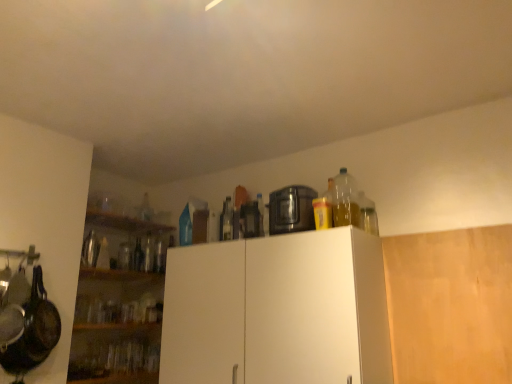
What do you see at coordinates (124, 222) in the screenshot? I see `wooden shelves at upper center` at bounding box center [124, 222].

How much space does black plastic toaster at upper center, the 2th appliance when ordered from left to right, occupy vertically?

black plastic toaster at upper center, the 2th appliance when ordered from left to right, is 7.35 inches tall.

Locate an element on the screen. This screenshot has height=384, width=512. transparent plastic bottle at upper center, the 4th bottle viewed from the right is located at coordinates (145, 209).

What is the approximate height of brushed metal thermos at left, the 1th appliance viewed from the left?

It is 10.02 inches.

Where is `wooden shelves at upper center`? wooden shelves at upper center is located at coordinates (124, 222).

From the image's perspective, is clear glass bottle at center, acting as the third bottle starting from the right, positioned above or below black plastic toaster at upper center, the second appliance in the right-to-left sequence?

Clearly, from the image's perspective, clear glass bottle at center, acting as the third bottle starting from the right, is below black plastic toaster at upper center, the second appliance in the right-to-left sequence.

Who is smaller, clear glass bottle at center, acting as the third bottle starting from the right, or black plastic toaster at upper center, the second appliance in the right-to-left sequence?

black plastic toaster at upper center, the second appliance in the right-to-left sequence, is smaller.

This screenshot has width=512, height=384. Find the location of `the 2nd bottle to the left of the black plastic toaster at upper center, the second appliance in the right-to-left sequence, starting your count from the anchor`. the 2nd bottle to the left of the black plastic toaster at upper center, the second appliance in the right-to-left sequence, starting your count from the anchor is located at coordinates (138, 256).

Considering the sizes of clear glass bottle at center, acting as the third bottle starting from the right, and black plastic toaster at upper center, the 2th appliance when ordered from left to right, in the image, is clear glass bottle at center, acting as the third bottle starting from the right, taller or shorter than black plastic toaster at upper center, the 2th appliance when ordered from left to right,?

Clearly, clear glass bottle at center, acting as the third bottle starting from the right, is taller compared to black plastic toaster at upper center, the 2th appliance when ordered from left to right.

From the image's perspective, would you say black matte frying pan at left is shown under white matte cabinet at upper center, which is the 1th cabinetry from left to right?

Result: Incorrect, from the image's perspective, black matte frying pan at left is higher than white matte cabinet at upper center, which is the 1th cabinetry from left to right.

Considering their positions, is black matte frying pan at left located in front of or behind white matte cabinet at upper center, which is the 1th cabinetry from left to right?

Visually, black matte frying pan at left is located behind white matte cabinet at upper center, which is the 1th cabinetry from left to right.

Can white matte cabinet at upper center, which is the 1th cabinetry from left to right, be found inside black matte frying pan at left?

That's incorrect, white matte cabinet at upper center, which is the 1th cabinetry from left to right, is not inside black matte frying pan at left.

In terms of width, does black matte frying pan at left look wider or thinner when compared to white matte cabinet at upper center, which is the 1th cabinetry from left to right?

Clearly, black matte frying pan at left has less width compared to white matte cabinet at upper center, which is the 1th cabinetry from left to right.

Is point (190, 380) in front of point (257, 216)?

Yes, it is.

Which object is wider, white matte cabinet at upper center, which is counted as the 2th cabinetry, starting from the right, or black plastic toaster at upper center, the 2th appliance when ordered from left to right?

white matte cabinet at upper center, which is counted as the 2th cabinetry, starting from the right.

Which of these two, white matte cabinet at upper center, which is the 1th cabinetry from left to right, or black plastic toaster at upper center, the 2th appliance when ordered from left to right, is bigger?

white matte cabinet at upper center, which is the 1th cabinetry from left to right, is bigger.

Is white matte cabinet at upper center, which is counted as the 2th cabinetry, starting from the right, in contact with black plastic toaster at upper center, the 2th appliance when ordered from left to right?

white matte cabinet at upper center, which is counted as the 2th cabinetry, starting from the right, and black plastic toaster at upper center, the 2th appliance when ordered from left to right, are not in contact.

Is the depth of wooden shelves at upper center less than that of black plastic toaster at upper center, the 2th appliance when ordered from left to right?

No, wooden shelves at upper center is further to the viewer.

Can you confirm if wooden shelves at upper center is positioned to the right of black plastic toaster at upper center, the 2th appliance when ordered from left to right?

No, wooden shelves at upper center is not to the right of black plastic toaster at upper center, the 2th appliance when ordered from left to right.

From a real-world perspective, is wooden shelves at upper center positioned above or below black plastic toaster at upper center, the 2th appliance when ordered from left to right?

wooden shelves at upper center is situated higher than black plastic toaster at upper center, the 2th appliance when ordered from left to right, in the real world.

Is wooden shelves at upper center placed right next to black plastic toaster at upper center, the second appliance in the right-to-left sequence?

No, wooden shelves at upper center is not in contact with black plastic toaster at upper center, the second appliance in the right-to-left sequence.

The height and width of the screenshot is (384, 512). Find the location of `appliance to the left of wooden shelves at upper center`. appliance to the left of wooden shelves at upper center is located at coordinates (90, 250).

Can you see wooden shelves at upper center touching brushed metal thermos at left, which is the 3th appliance from right to left?

There is a gap between wooden shelves at upper center and brushed metal thermos at left, which is the 3th appliance from right to left.

Is wooden shelves at upper center oriented towards brushed metal thermos at left, the 1th appliance viewed from the left?

No, wooden shelves at upper center is not oriented towards brushed metal thermos at left, the 1th appliance viewed from the left.

From the picture: Is brushed metal thermos at left, the 1th appliance viewed from the left, surrounded by wooden shelves at upper center?

No.

Is clear glass bottle at center, which is the 2th bottle from back to front, at the left side of clear glass bottle at center, the second bottle viewed from the right?

Correct, you'll find clear glass bottle at center, which is the 2th bottle from back to front, to the left of clear glass bottle at center, the second bottle viewed from the right.

Can we say clear glass bottle at center, which is the third bottle from front to back, lies outside clear glass bottle at center, the second bottle viewed from the right?

Yes, clear glass bottle at center, which is the third bottle from front to back, is not within clear glass bottle at center, the second bottle viewed from the right.

Could you tell me if clear glass bottle at center, which is the third bottle from front to back, is facing clear glass bottle at center, the second bottle viewed from the right?

Yes, clear glass bottle at center, which is the third bottle from front to back, is oriented towards clear glass bottle at center, the second bottle viewed from the right.

Based on the photo, from the image's perspective, does clear glass bottle at center, which is the third bottle from front to back, appear higher than clear glass bottle at center, the second bottle viewed from the right?

Incorrect, from the image's perspective, clear glass bottle at center, which is the third bottle from front to back, is lower than clear glass bottle at center, the second bottle viewed from the right.

Considering the sizes of transparent plastic bottle at upper center, which is the first bottle from left to right, and brushed metal thermos at left, the 1th appliance viewed from the left, in the image, is transparent plastic bottle at upper center, which is the first bottle from left to right, taller or shorter than brushed metal thermos at left, the 1th appliance viewed from the left,?

In the image, transparent plastic bottle at upper center, which is the first bottle from left to right, appears to be taller than brushed metal thermos at left, the 1th appliance viewed from the left.

Which appliance is the 1st one when counting from the front of the transparent plastic bottle at upper center, which is the fourth bottle from front to back? Please provide its 2D coordinates.

[(90, 250)]

Is transparent plastic bottle at upper center, which is the fourth bottle from front to back, facing away from brushed metal thermos at left, which is the 3th appliance from right to left?

That's not correct — transparent plastic bottle at upper center, which is the fourth bottle from front to back, is not looking away from brushed metal thermos at left, which is the 3th appliance from right to left.

Is transparent plastic bottle at upper center, the 4th bottle viewed from the right, surrounding brushed metal thermos at left, the 1th appliance viewed from the left?

Definitely not — brushed metal thermos at left, the 1th appliance viewed from the left, is not inside transparent plastic bottle at upper center, the 4th bottle viewed from the right.

From a real-world perspective, count 3rd appliances upward from the clear glass bottle at center, which is the 2th bottle from back to front, and point to it. Please provide its 2D coordinates.

[(250, 220)]

Find the location of `frying pan above the white matte cabinet at upper center, which is counted as the 2th cabinetry, starting from the right (from the image's perspective)`. frying pan above the white matte cabinet at upper center, which is counted as the 2th cabinetry, starting from the right (from the image's perspective) is located at coordinates (33, 331).

Which object lies nearer to the anchor point white matte cabinet at upper center, which is the 1th cabinetry from left to right, clear glass bottle at center, which ranks as the third bottle in left-to-right order, or transparent plastic bottle at upper center, which is the first bottle from left to right?

clear glass bottle at center, which ranks as the third bottle in left-to-right order.

Which object lies further to the anchor point clear glass bottle at center, acting as the third bottle starting from the back, black matte frying pan at left or white matte cabinet at upper center, which is the 1th cabinetry from left to right?

Based on the image, black matte frying pan at left appears to be further to clear glass bottle at center, acting as the third bottle starting from the back.

Considering their positions, is white matte cabinet at upper center, which is counted as the 2th cabinetry, starting from the right, positioned further to black matte frying pan at left than clear glass bottle at center, the 2th bottle viewed from the left?

clear glass bottle at center, the 2th bottle viewed from the left, is further to black matte frying pan at left.

Estimate the real-world distances between objects in this image. Which object is closer to translucent plastic bottle at upper right, the 1th bottle from the right, transparent plastic bottle at upper center, the 4th bottle viewed from the right, or clear glass bottle at center, which is the third bottle from front to back?

transparent plastic bottle at upper center, the 4th bottle viewed from the right, is closer to translucent plastic bottle at upper right, the 1th bottle from the right.

Estimate the real-world distances between objects in this image. Which object is further from wooden shelves at upper center, clear glass bottle at center, the 2th bottle viewed from the left, or brushed metal thermos at left, the 1th appliance viewed from the left?

Among the two, brushed metal thermos at left, the 1th appliance viewed from the left, is located further to wooden shelves at upper center.

Considering their positions, is clear glass bottle at center, which is the third bottle from front to back, positioned further to black matte frying pan at left than black plastic toaster at upper center, the second appliance in the right-to-left sequence?

clear glass bottle at center, which is the third bottle from front to back, is further to black matte frying pan at left.

Based on their spatial positions, is brushed metal thermos at left, the 1th appliance viewed from the left, or wooden shelves at upper center closer to black matte frying pan at left?

brushed metal thermos at left, the 1th appliance viewed from the left, is positioned closer to the anchor black matte frying pan at left.

Which object lies further to the anchor point white matte cabinet at upper center, which is counted as the 2th cabinetry, starting from the right, black plastic food processor at upper center, acting as the first appliance starting from the right, or transparent plastic bottle at upper center, which is the fourth bottle from front to back?

transparent plastic bottle at upper center, which is the fourth bottle from front to back, lies further to white matte cabinet at upper center, which is counted as the 2th cabinetry, starting from the right, than the other object.

Identify the location of bottle between brushed metal thermos at left, which is the 3th appliance from right to left, and transparent plastic bottle at upper center, which is the first bottle from left to right, from front to back. Image resolution: width=512 pixels, height=384 pixels. (138, 256).

You are a GUI agent. You are given a task and a screenshot of the screen. Output one action in this format:
    pyautogui.click(x=<x>, y=<y>)
    Task: Click on the cabinetry between black matte frying pan at left and translucent plastic bottle at upper right, which is the fourth bottle in left-to-right order, from left to right
    
    Given the screenshot: What is the action you would take?
    pyautogui.click(x=277, y=311)

Where is `shelf between black matte frying pan at left and transparent plastic bottle at upper center, which is the fourth bottle from front to back, in the front-back direction`? The width and height of the screenshot is (512, 384). shelf between black matte frying pan at left and transparent plastic bottle at upper center, which is the fourth bottle from front to back, in the front-back direction is located at coordinates (124, 222).

Locate an element on the screen. The width and height of the screenshot is (512, 384). bottle between clear glass bottle at center, which is the 2th bottle from back to front, and black plastic toaster at upper center, the 2th appliance when ordered from left to right, from left to right is located at coordinates (226, 220).